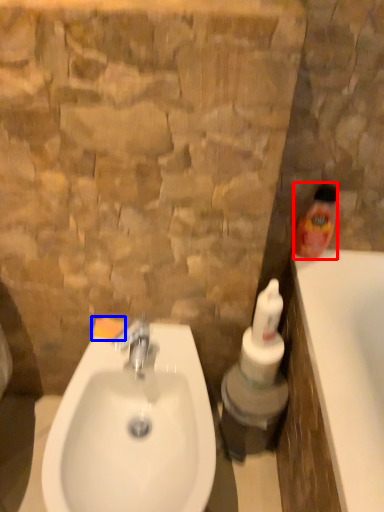
Question: Which object appears closest to the camera in this image, cleaning product (highlighted by a red box) or soap (highlighted by a blue box)?

Choices:
 (A) cleaning product
 (B) soap

Answer: (A)